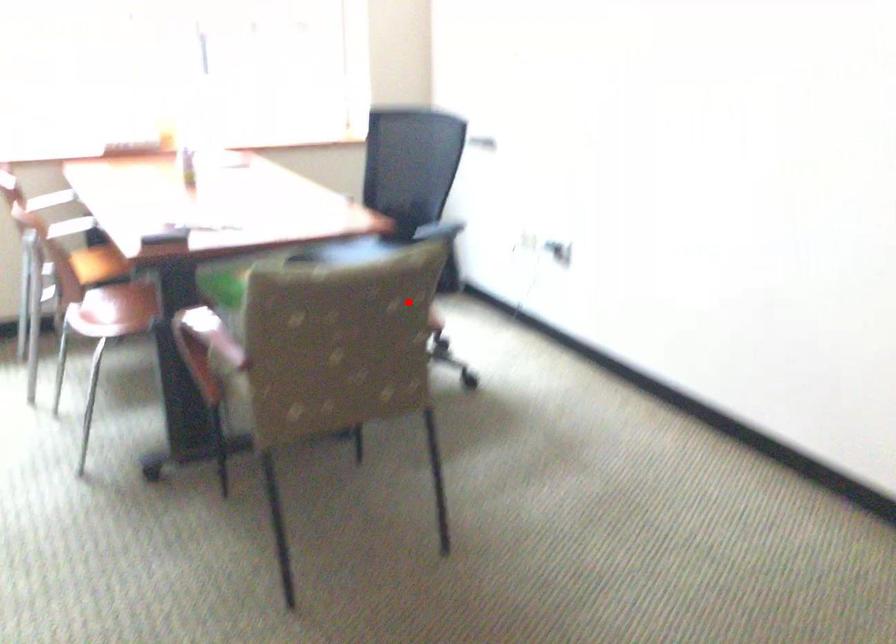
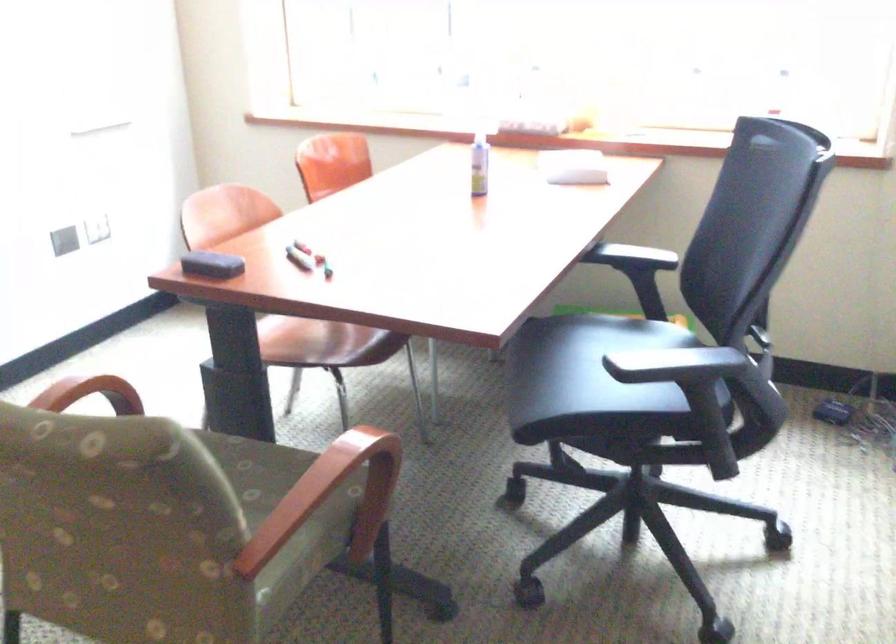
Locate, in the second image, the point that corresponds to the highlighted location in the first image.

(331, 496)